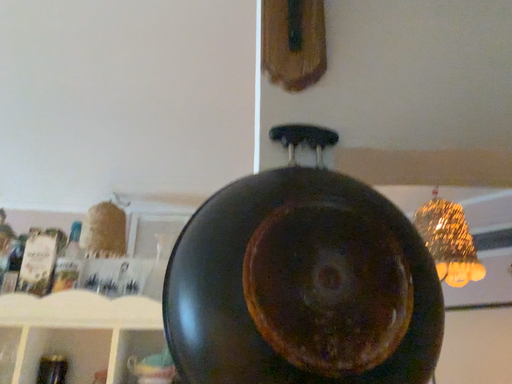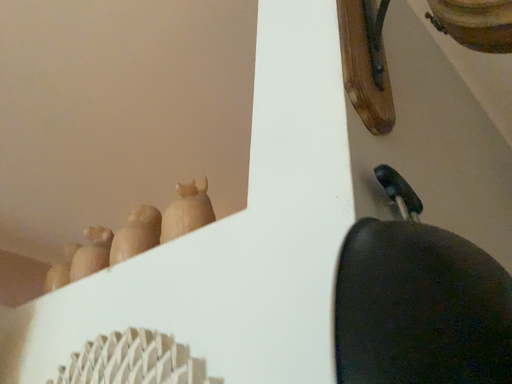
Question: Which way did the camera rotate in the video?

Choices:
 (A) rotated right
 (B) rotated left

Answer: (A)